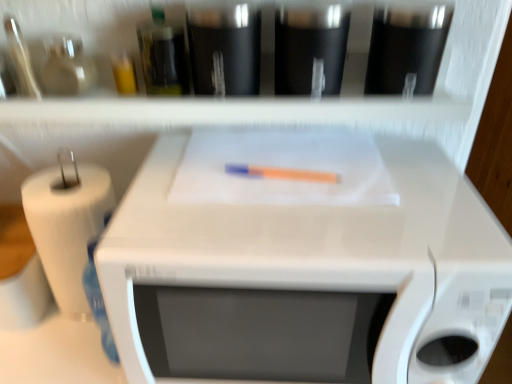
The width and height of the screenshot is (512, 384). I want to click on blank space situated above white glossy microwave at center (from a real-world perspective), so coord(305,187).